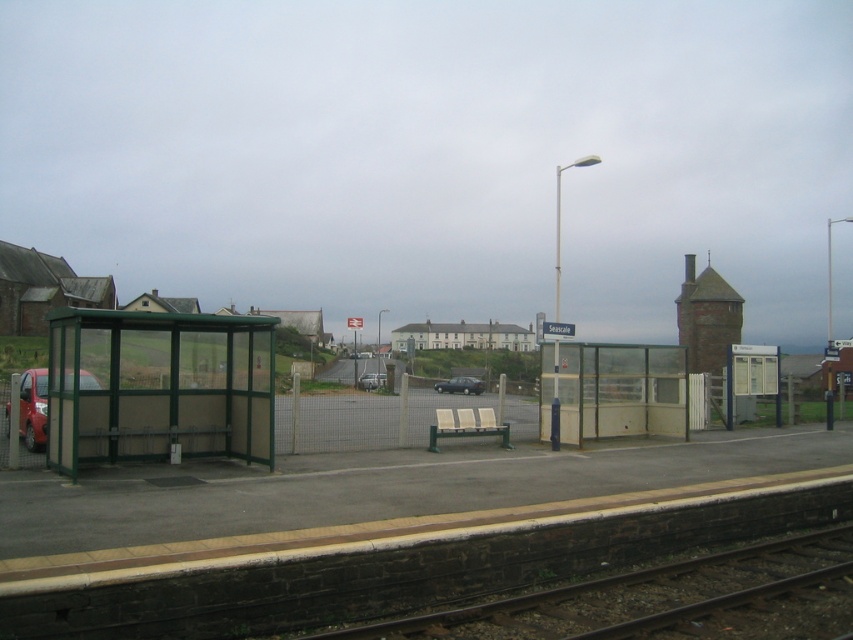
Describe the element at coordinates (666, 600) in the screenshot. I see `brown brick train track at lower center` at that location.

Does brown brick train track at lower center have a greater height compared to matte red car at left?

No, brown brick train track at lower center is not taller than matte red car at left.

Which is behind, point (543, 604) or point (25, 396)?

Point (25, 396)

In order to click on brown brick train track at lower center in this screenshot , I will do `click(666, 600)`.

Does point (221, 364) come behind point (440, 388)?

That is False.

Based on the photo, does green metallic bus stop at left lie behind matte black car at center?

That is False.

Who is more forward, (102, 417) or (453, 380)?

Point (102, 417)

This screenshot has width=853, height=640. I want to click on green metallic bus stop at left, so click(x=158, y=387).

Between point (57, 330) and point (4, 404), which one is positioned behind?

The point (4, 404) is more distant.

Consider the image. Is green metallic bus stop at left thinner than matte red car at left?

Yes, green metallic bus stop at left is thinner than matte red car at left.

The height and width of the screenshot is (640, 853). What are the coordinates of `green metallic bus stop at left` in the screenshot? It's located at (158, 387).